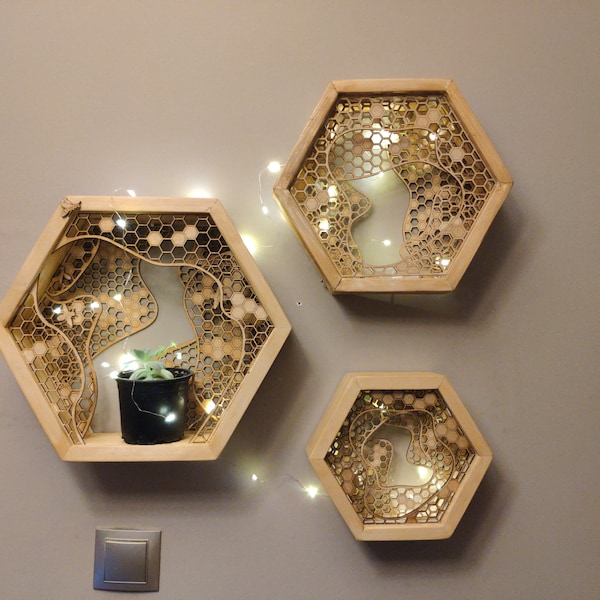
The image size is (600, 600). Identify the location of plant. (145, 365).